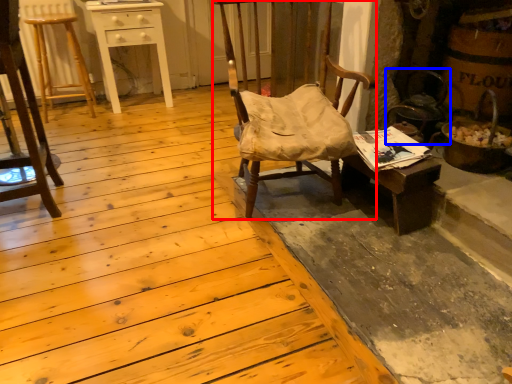
Question: Among these objects, which one is farthest to the camera, chair (highlighted by a red box) or swivel chair (highlighted by a blue box)?

Choices:
 (A) chair
 (B) swivel chair

Answer: (B)